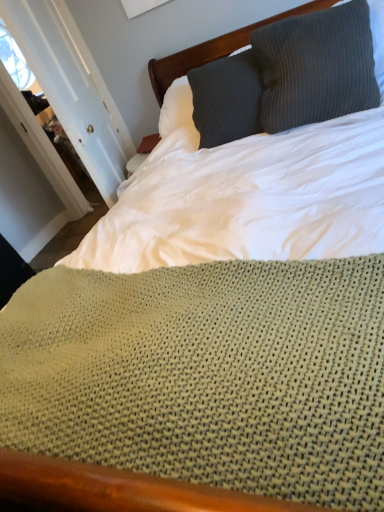
Image resolution: width=384 pixels, height=512 pixels. Find the location of `knitted gray pillow at upper right`. knitted gray pillow at upper right is located at coordinates (316, 67).

Describe the element at coordinates (316, 67) in the screenshot. The image size is (384, 512). I see `knitted gray pillow at upper right` at that location.

The height and width of the screenshot is (512, 384). What are the coordinates of `white painted wood door at upper left` in the screenshot? It's located at (72, 87).

This screenshot has height=512, width=384. What do you see at coordinates (72, 87) in the screenshot?
I see `white painted wood door at upper left` at bounding box center [72, 87].

Where is `knitted gray pillow at upper right`? This screenshot has height=512, width=384. knitted gray pillow at upper right is located at coordinates (316, 67).

Between white painted wood door at upper left and knitted gray pillow at upper right, which one appears on the left side from the viewer's perspective?

white painted wood door at upper left.

Is the depth of white painted wood door at upper left greater than that of knitted gray pillow at upper right?

Yes, white painted wood door at upper left is further from the camera.

Is point (68, 45) farther from camera compared to point (305, 33)?

That is True.

From the image's perspective, which is below, white painted wood door at upper left or knitted gray pillow at upper right?

From the image's view, white painted wood door at upper left is below.

Consider the image. From a real-world perspective, is white painted wood door at upper left located beneath knitted gray pillow at upper right?

No.

Looking at their sizes, would you say white painted wood door at upper left is wider or thinner than knitted gray pillow at upper right?

In the image, white painted wood door at upper left appears to be more narrow than knitted gray pillow at upper right.

Does white painted wood door at upper left have a greater height compared to knitted gray pillow at upper right?

Correct, white painted wood door at upper left is much taller as knitted gray pillow at upper right.

Can you confirm if white painted wood door at upper left is smaller than knitted gray pillow at upper right?

No.

Is white painted wood door at upper left situated inside knitted gray pillow at upper right or outside?

white painted wood door at upper left is not inside knitted gray pillow at upper right, it's outside.

Are white painted wood door at upper left and knitted gray pillow at upper right making contact?

No.

Could you tell me if white painted wood door at upper left is turned towards knitted gray pillow at upper right?

No, white painted wood door at upper left is not facing towards knitted gray pillow at upper right.

How distant is white painted wood door at upper left from knitted gray pillow at upper right?

The distance of white painted wood door at upper left from knitted gray pillow at upper right is 1.13 meters.

Image resolution: width=384 pixels, height=512 pixels. Identify the location of door positioned vertically above the knitted gray pillow at upper right (from a real-world perspective). (72, 87).

Can you confirm if knitted gray pillow at upper right is positioned to the left of white painted wood door at upper left?

In fact, knitted gray pillow at upper right is to the right of white painted wood door at upper left.

Which is in front, knitted gray pillow at upper right or white painted wood door at upper left?

knitted gray pillow at upper right is in front.

Is point (343, 66) closer or farther from the camera than point (50, 33)?

Point (343, 66) is closer to the camera than point (50, 33).

Based on the photo, from the image's perspective, relative to white painted wood door at upper left, is knitted gray pillow at upper right above or below?

knitted gray pillow at upper right is above white painted wood door at upper left.

In the scene shown: From a real-world perspective, relative to white painted wood door at upper left, is knitted gray pillow at upper right vertically above or below?

Clearly, from a real-world perspective, knitted gray pillow at upper right is below white painted wood door at upper left.

Looking at this image, considering the relative sizes of knitted gray pillow at upper right and white painted wood door at upper left in the image provided, is knitted gray pillow at upper right thinner than white painted wood door at upper left?

In fact, knitted gray pillow at upper right might be wider than white painted wood door at upper left.

Based on the photo, considering the sizes of knitted gray pillow at upper right and white painted wood door at upper left in the image, is knitted gray pillow at upper right taller or shorter than white painted wood door at upper left?

knitted gray pillow at upper right is shorter than white painted wood door at upper left.

Which of these two, knitted gray pillow at upper right or white painted wood door at upper left, is smaller?

With smaller size is knitted gray pillow at upper right.

Would you say knitted gray pillow at upper right is inside or outside white painted wood door at upper left?

knitted gray pillow at upper right is outside white painted wood door at upper left.

From the picture: Is knitted gray pillow at upper right far from white painted wood door at upper left?

knitted gray pillow at upper right is far away from white painted wood door at upper left.

Does knitted gray pillow at upper right turn towards white painted wood door at upper left?

No, knitted gray pillow at upper right is not aimed at white painted wood door at upper left.

What's the angular difference between knitted gray pillow at upper right and white painted wood door at upper left's facing directions?

The angle between the facing direction of knitted gray pillow at upper right and the facing direction of white painted wood door at upper left is 69.1 degrees.

You are a GUI agent. You are given a task and a screenshot of the screen. Output one action in this format:
    pyautogui.click(x=<x>, y=<y>)
    Task: Click on the pillow that is on the right side of white painted wood door at upper left
    Image resolution: width=384 pixels, height=512 pixels.
    Given the screenshot: What is the action you would take?
    pyautogui.click(x=316, y=67)

Locate an element on the screen. This screenshot has height=512, width=384. door positioned vertically above the knitted gray pillow at upper right (from a real-world perspective) is located at coordinates (72, 87).

Identify the location of door behind the knitted gray pillow at upper right. (72, 87).